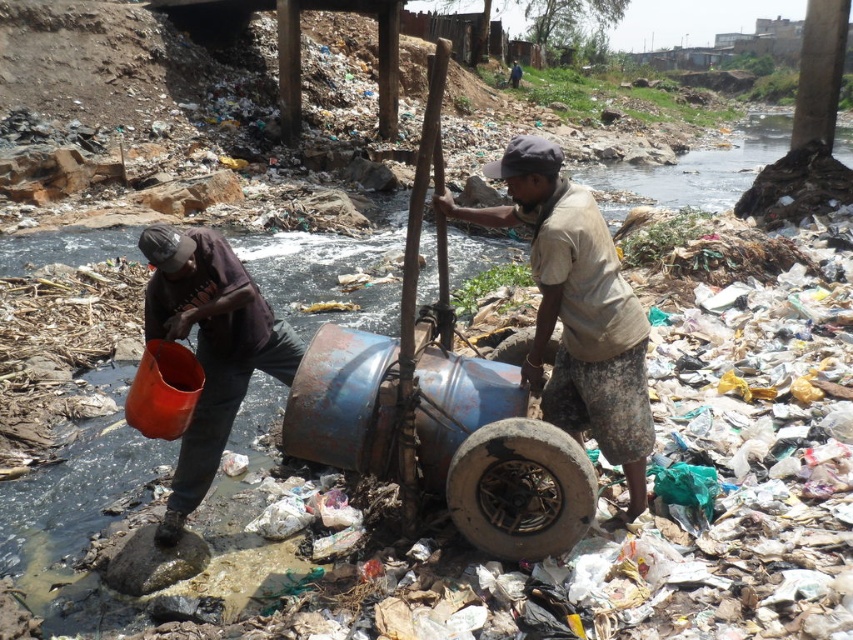
Can you confirm if matte orange bucket at left is positioned to the right of charred rubber tire at lower center?

In fact, matte orange bucket at left is to the left of charred rubber tire at lower center.

Is point (202, 458) farther from camera compared to point (502, 472)?

Yes, point (202, 458) is farther from viewer.

The height and width of the screenshot is (640, 853). Find the location of `matte orange bucket at left`. matte orange bucket at left is located at coordinates (209, 348).

Locate an element on the screen. Image resolution: width=853 pixels, height=640 pixels. camouflage shorts at center is located at coordinates (576, 308).

Is point (543, 294) closer to viewer compared to point (196, 280)?

Yes, point (543, 294) is in front of point (196, 280).

Which is behind, point (546, 253) or point (195, 472)?

The point (195, 472) is more distant.

What are the coordinates of `camouflage shorts at center` in the screenshot? It's located at (576, 308).

Who is positioned more to the right, camouflage shorts at center or charred rubber tire at lower center?

Positioned to the right is camouflage shorts at center.

Can you confirm if camouflage shorts at center is thinner than charred rubber tire at lower center?

Incorrect, camouflage shorts at center's width is not less than charred rubber tire at lower center's.

Is point (582, 344) positioned behind point (529, 420)?

Yes, point (582, 344) is behind point (529, 420).

Locate an element on the screen. camouflage shorts at center is located at coordinates (576, 308).